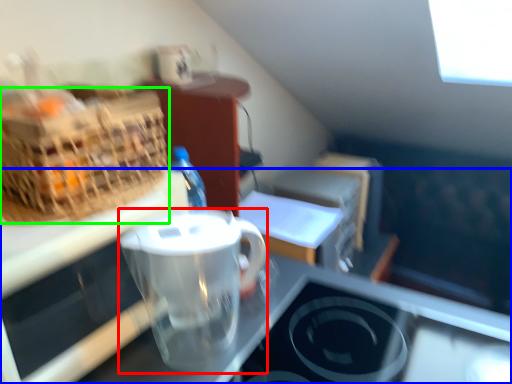
Question: Based on their relative distances, which object is nearer to coffee cup (highlighted by a red box)? Choose from desk (highlighted by a blue box) and picnic basket (highlighted by a green box).

Choices:
 (A) desk
 (B) picnic basket

Answer: (A)